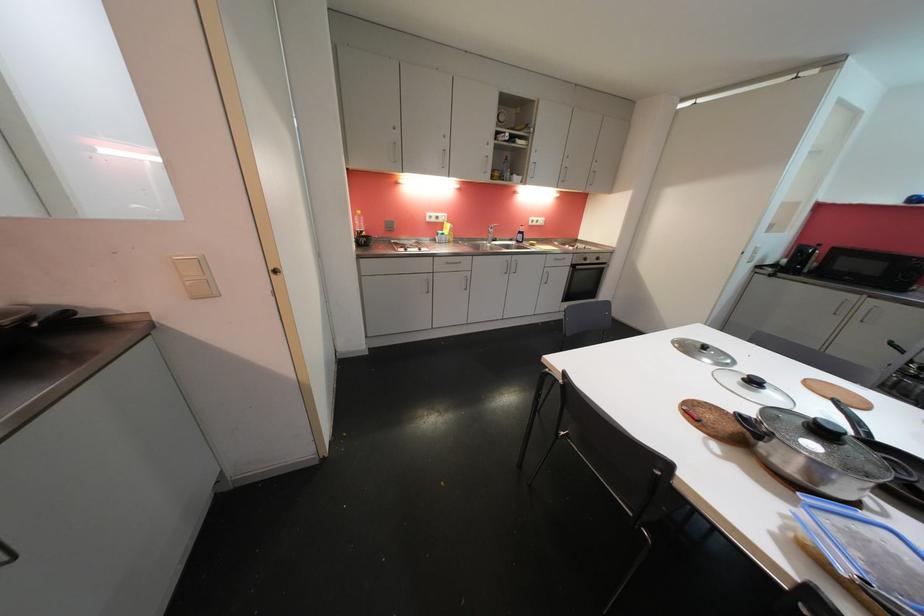
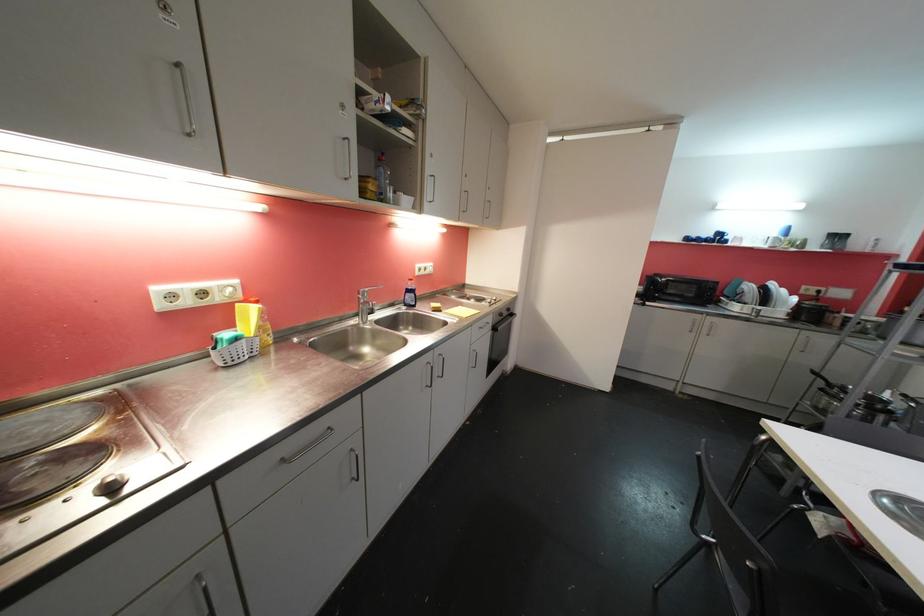
Locate, in the second image, the point that corresponds to (456,233) in the first image.

(265, 322)